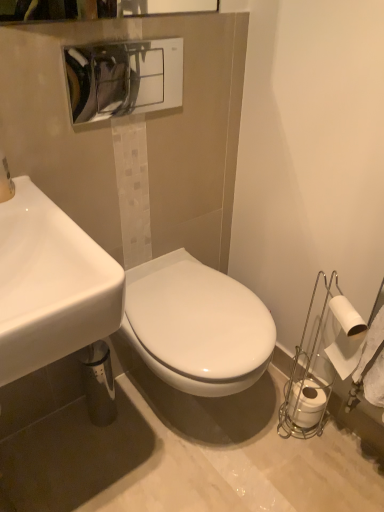
Question: In terms of size, does white matte toilet paper at lower right, the second toilet paper from the back, appear bigger or smaller than matte white hand dryer at upper center?

Choices:
 (A) small
 (B) big

Answer: (A)

Question: Do you think white matte toilet paper at lower right, the first toilet paper positioned from the front, is within matte white hand dryer at upper center, or outside of it?

Choices:
 (A) outside
 (B) inside

Answer: (A)

Question: Which object is the farthest from the white glossy sink at center, the 2th sink in the front-to-back sequence?

Choices:
 (A) white glossy sink at left, the 2th sink viewed from the back
 (B) white matte toilet paper at lower right, which is counted as the 2th toilet paper, starting from the top
 (C) matte white hand dryer at upper center
 (D) white matte toilet paper at lower right, the second toilet paper from the back

Answer: (C)

Question: Considering the real-world distances, which object is farthest from the white matte toilet paper at lower right, which is counted as the 2th toilet paper, starting from the top?

Choices:
 (A) white matte toilet paper at lower right, the second toilet paper from the back
 (B) matte white hand dryer at upper center
 (C) white glossy sink at left, the 1th sink when ordered from front to back
 (D) white glossy sink at center, which is the first sink in back-to-front order

Answer: (B)